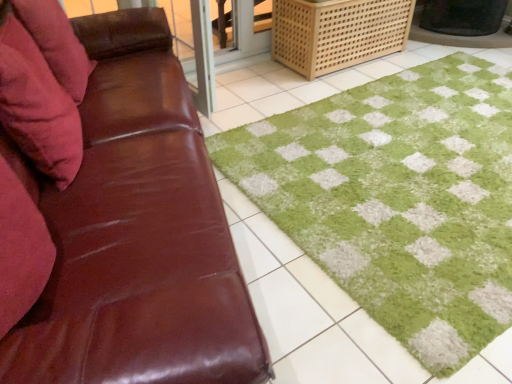
Question: Considering the relative positions of green shaggy bath mat at center and velvety pink pillow at left, which ranks as the second pillow in front-to-back order, in the image provided, is green shaggy bath mat at center to the right of velvety pink pillow at left, which ranks as the second pillow in front-to-back order, from the viewer's perspective?

Choices:
 (A) no
 (B) yes

Answer: (B)

Question: From a real-world perspective, is green shaggy bath mat at center located higher than velvety pink pillow at left, which is counted as the 1th pillow, starting from the back?

Choices:
 (A) no
 (B) yes

Answer: (A)

Question: From the image's perspective, is green shaggy bath mat at center located beneath velvety pink pillow at left, which is counted as the 1th pillow, starting from the back?

Choices:
 (A) no
 (B) yes

Answer: (B)

Question: Is green shaggy bath mat at center far away from velvety pink pillow at left, which ranks as the second pillow in front-to-back order?

Choices:
 (A) yes
 (B) no

Answer: (A)

Question: Is green shaggy bath mat at center facing away from velvety pink pillow at left, which is counted as the 1th pillow, starting from the back?

Choices:
 (A) yes
 (B) no

Answer: (B)

Question: Is green shaggy bath mat at center bigger than velvety pink pillow at left, which is counted as the 1th pillow, starting from the back?

Choices:
 (A) no
 (B) yes

Answer: (B)

Question: Considering the relative sizes of velvety pink pillow at left, which is counted as the 1th pillow, starting from the back, and velvet red pillow at left, arranged as the first pillow when viewed from the front, in the image provided, is velvety pink pillow at left, which is counted as the 1th pillow, starting from the back, taller than velvet red pillow at left, arranged as the first pillow when viewed from the front,?

Choices:
 (A) yes
 (B) no

Answer: (B)

Question: From a real-world perspective, is velvety pink pillow at left, which ranks as the second pillow in front-to-back order, physically below velvet red pillow at left, which is counted as the second pillow, starting from the back?

Choices:
 (A) no
 (B) yes

Answer: (B)

Question: Is velvety pink pillow at left, which ranks as the second pillow in front-to-back order, positioned beyond the bounds of velvet red pillow at left, which is counted as the second pillow, starting from the back?

Choices:
 (A) no
 (B) yes

Answer: (B)

Question: Is velvety pink pillow at left, which ranks as the second pillow in front-to-back order, positioned before velvet red pillow at left, arranged as the first pillow when viewed from the front?

Choices:
 (A) yes
 (B) no

Answer: (B)

Question: Is velvet red pillow at left, which is counted as the second pillow, starting from the back, at the back of velvety pink pillow at left, which ranks as the second pillow in front-to-back order?

Choices:
 (A) yes
 (B) no

Answer: (B)

Question: Is velvet red pillow at left, which is counted as the second pillow, starting from the back, a part of velvety pink pillow at left, which ranks as the second pillow in front-to-back order?

Choices:
 (A) yes
 (B) no

Answer: (B)

Question: Does velvety pink pillow at left, which ranks as the second pillow in front-to-back order, turn towards light brown woven crate at upper right?

Choices:
 (A) yes
 (B) no

Answer: (A)